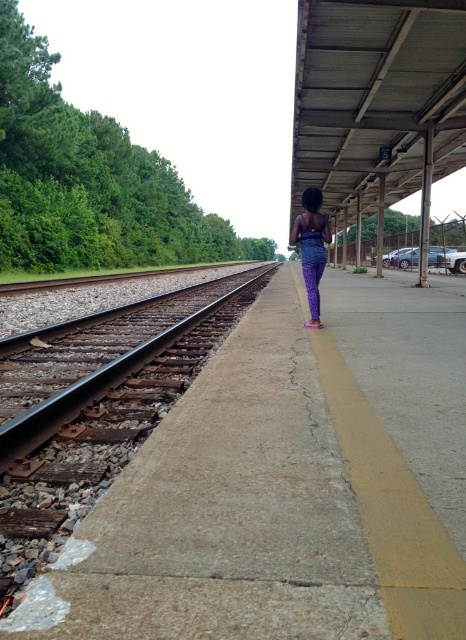
Which is above, brown gravel track at left or purple fabric pants at center?

brown gravel track at left is above.

Is point (96, 396) closer to viewer compared to point (316, 225)?

That is True.

Which is in front, point (90, 385) or point (294, 232)?

Point (90, 385)

Locate an element on the screen. The height and width of the screenshot is (640, 466). brown gravel track at left is located at coordinates (95, 385).